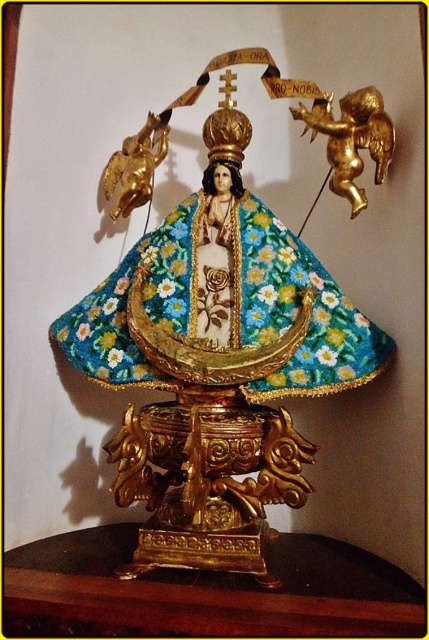
Is gold textured statue at center to the left of gold/gilded cherub at upper left from the viewer's perspective?

In fact, gold textured statue at center is to the right of gold/gilded cherub at upper left.

Is gold textured statue at center smaller than gold/gilded cherub at upper left?

Actually, gold textured statue at center might be larger than gold/gilded cherub at upper left.

Find the location of a particular element. This screenshot has width=429, height=640. gold textured statue at center is located at coordinates (217, 364).

The image size is (429, 640). Find the location of `gold textured statue at center`. gold textured statue at center is located at coordinates (217, 364).

Does brown polished wood table at lower center appear over gold metallic cherub at upper right?

Incorrect, brown polished wood table at lower center is not positioned above gold metallic cherub at upper right.

Which is more to the right, brown polished wood table at lower center or gold metallic cherub at upper right?

gold metallic cherub at upper right is more to the right.

Is point (27, 605) more distant than point (299, 104)?

No.

The image size is (429, 640). Find the location of `brown polished wood table at lower center`. brown polished wood table at lower center is located at coordinates [210, 589].

Between gold metallic cherub at upper right and gold/gilded cherub at upper left, which one is positioned higher?

gold metallic cherub at upper right is above.

Which is more to the right, gold metallic cherub at upper right or gold/gilded cherub at upper left?

Positioned to the right is gold metallic cherub at upper right.

Who is more forward, (340, 129) or (156, 166)?

Point (340, 129) is more forward.

You are a GUI agent. You are given a task and a screenshot of the screen. Output one action in this format:
    pyautogui.click(x=<x>, y=<y>)
    Task: Click on the gold metallic cherub at upper right
    The height and width of the screenshot is (640, 429).
    Given the screenshot: What is the action you would take?
    pyautogui.click(x=352, y=140)